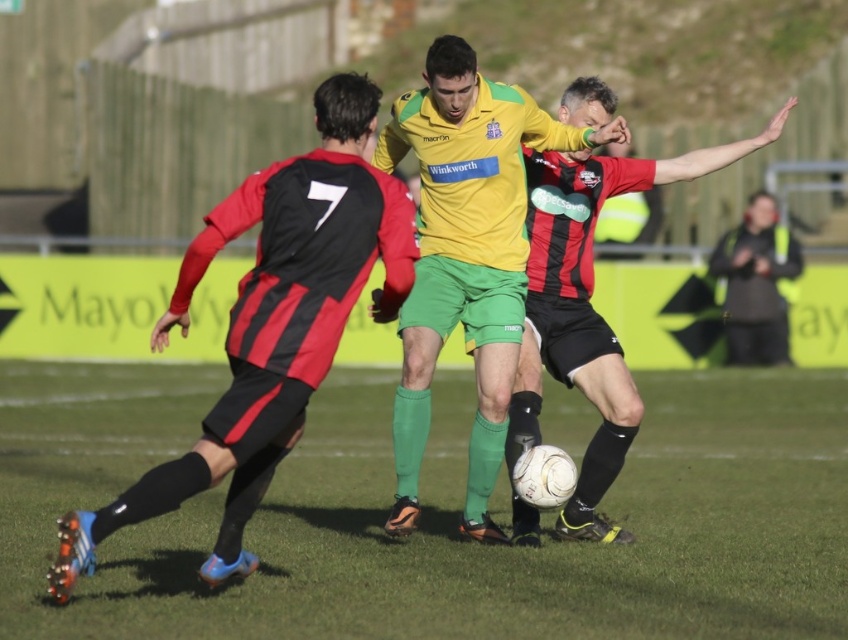
From the picture: You are a soccer coach analyzing the match. You notice two points marked on the field at coordinates point [512,426] and point [795,253]. Which point is closer to the camera?

Point [512,426] is closer to the viewer than point [795,253].

You are a soccer referee observing the match. You need to determine if the ball is within the playable area. Based on the positions of the green grass at center and yellow jersey at center, is the ball likely on the field?

The green grass at center is positioned under yellow jersey at center, which indicates that the ball is on the field since the player in the yellow jersey is standing on the grass.

You are a soccer coach analyzing the players on the field. You notice the matte black shorts at center and the black matte jacket at right. Which of these two items is bigger in size?

The matte black shorts at center is larger in size than the black matte jacket at right.